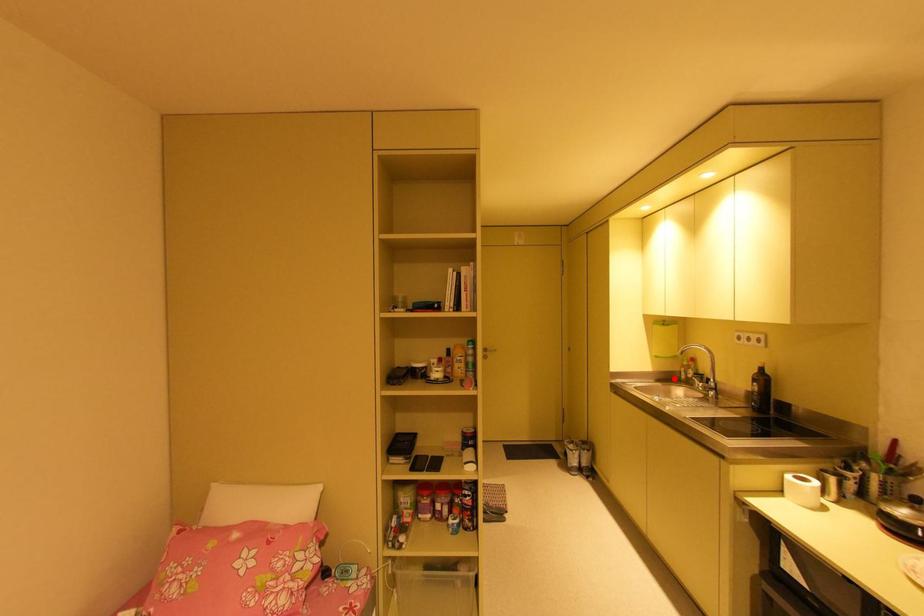
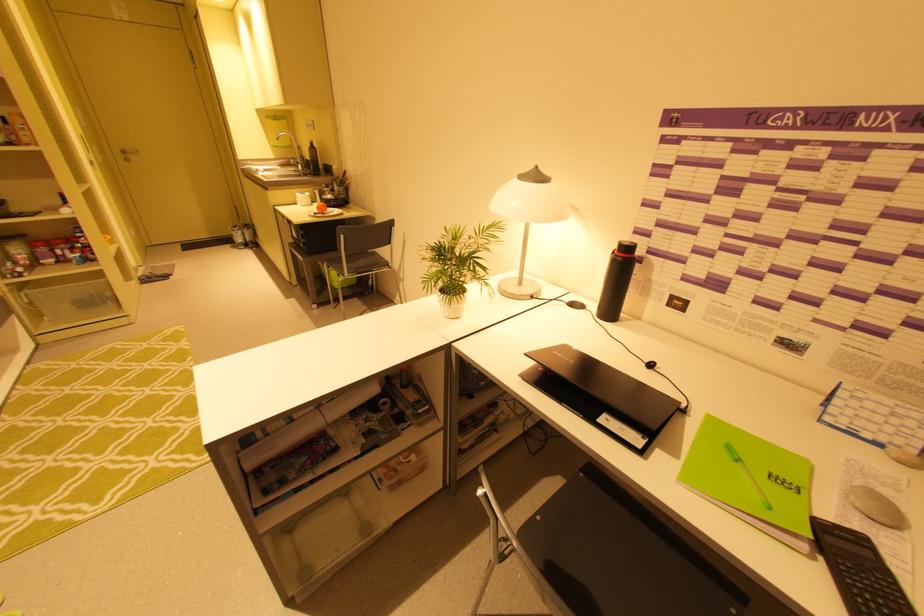
Question: I am providing you with two images of the same scene from different viewpoints. In image1, a red point is highlighted. Considering the same 3D point in image2, which of the following is correct?

Choices:
 (A) It is closer
 (B) It is farther

Answer: (A)